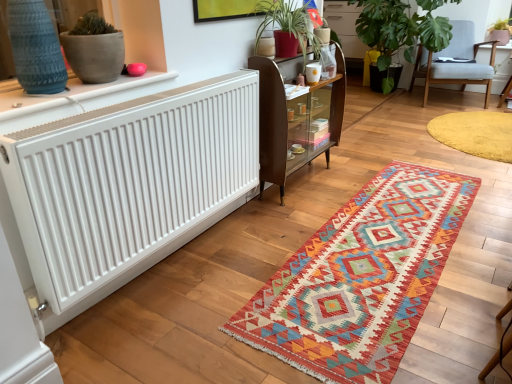
You are a GUI agent. You are given a task and a screenshot of the screen. Output one action in this format:
    pyautogui.click(x=<x>, y=<y>)
    Task: Click on the empty space that is in between white matte radiator at left and knitted woolen rug at center, the second mat when ordered from right to left
    Image resolution: width=512 pixels, height=384 pixels.
    Given the screenshot: What is the action you would take?
    click(207, 302)